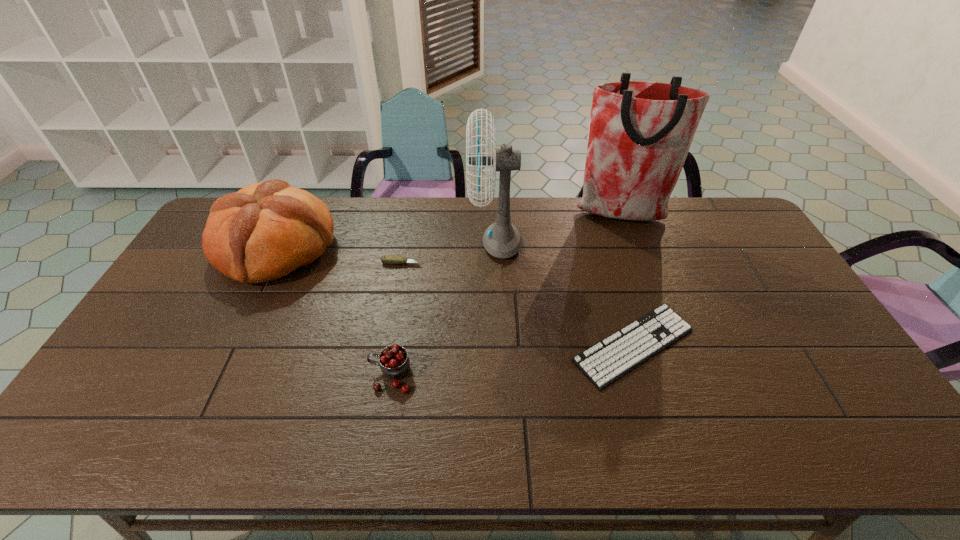
At what (x,y) coordinates should I click in order to perform the action: click on vacant region located on the front-facing side of the fourth object from left to right. Please return your answer as a coordinate pair (x, y). Looking at the image, I should click on (367, 242).

You are a GUI agent. You are given a task and a screenshot of the screen. Output one action in this format:
    pyautogui.click(x=<x>, y=<y>)
    Task: Click on the vacant region located 0.220m on the front of the third tallest object
    
    Given the screenshot: What is the action you would take?
    pyautogui.click(x=225, y=352)

This screenshot has width=960, height=540. Find the location of `vacant space located 0.170m on the handle side of the fourth tallest object`. vacant space located 0.170m on the handle side of the fourth tallest object is located at coordinates (303, 375).

The width and height of the screenshot is (960, 540). I want to click on vacant region located 0.220m on the handle side of the fourth tallest object, so click(284, 375).

You are a GUI agent. You are given a task and a screenshot of the screen. Output one action in this format:
    pyautogui.click(x=<x>, y=<y>)
    Task: Click on the vacant space positioned 0.290m on the handle side of the fourth tallest object
    Image resolution: width=960 pixels, height=540 pixels.
    Given the screenshot: What is the action you would take?
    pyautogui.click(x=257, y=375)

Identify the location of vacant space situated 0.230m on the left of the fifth tallest object. This screenshot has height=540, width=960. (312, 263).

You are a GUI agent. You are given a task and a screenshot of the screen. Output one action in this format:
    pyautogui.click(x=<x>, y=<y>)
    Task: Click on the free location located 0.290m on the left of the shortest object
    The height and width of the screenshot is (540, 960).
    Given the screenshot: What is the action you would take?
    pyautogui.click(x=463, y=346)

Where is `grocery bag that is at the far edge`? grocery bag that is at the far edge is located at coordinates (640, 132).

Image resolution: width=960 pixels, height=540 pixels. I want to click on fan that is positioned at the far edge, so click(501, 239).

Identify the location of bread that is at the far edge. The width and height of the screenshot is (960, 540). (266, 230).